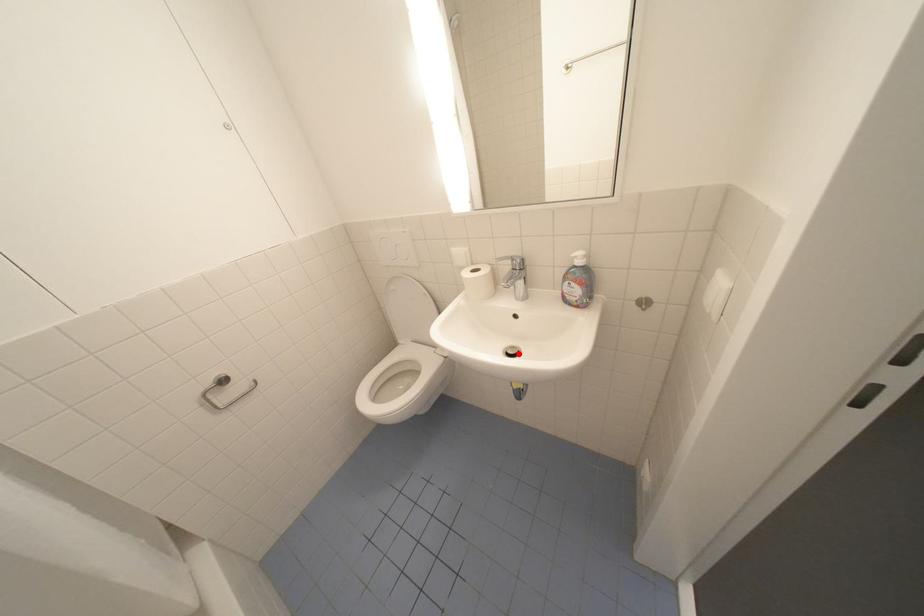
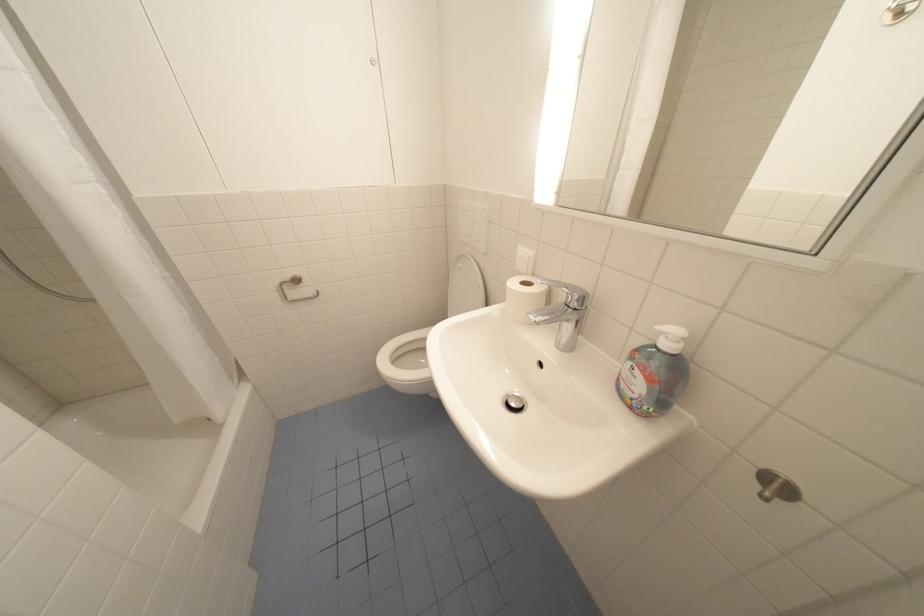
Where in the second image is the point corresponding to the highlighted location from the first image?

(520, 405)